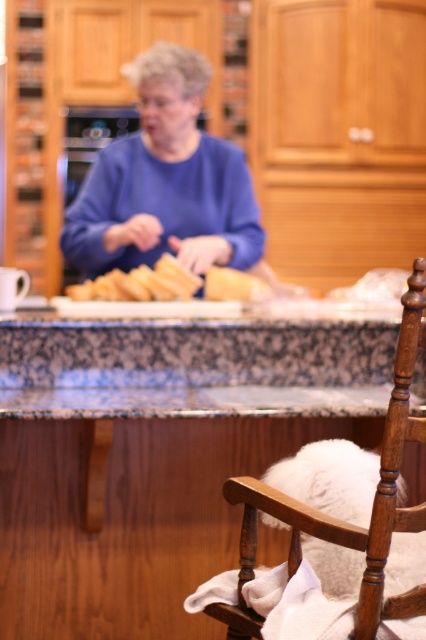
You are a chef preparing to place a blue matte sweater at center on a shelf that can only hold items within 10 inches of the golden brown bread at center. Will the sweater fit on the shelf?

The blue matte sweater at center is 11.28 inches from golden brown bread at center, which exceeds the shelf requirement of 10 inches. Therefore, the sweater will not fit on the shelf.

You are standing in the kitchen and want to sit down. Where is the wooden rocking chair at lower right located in the image?

The wooden rocking chair at lower right is located at point (339, 520) in the image.

You are a chef preparing to place both the blue matte sweater at center and the golden brown bread at center on a shelf. The shelf has a maximum weight capacity of 5 kilograms. Given that the sweater weighs 3 kilograms and the bread weighs 1.5 kilograms, can both items be placed on the shelf together without exceeding the weight limit?

The blue matte sweater at center weighs 3 kilograms and the golden brown bread at center weighs 1.5 kilograms. Combined, they total 4.5 kilograms, which is under the 5 kilogram limit. Therefore, both items can be placed on the shelf together safely.